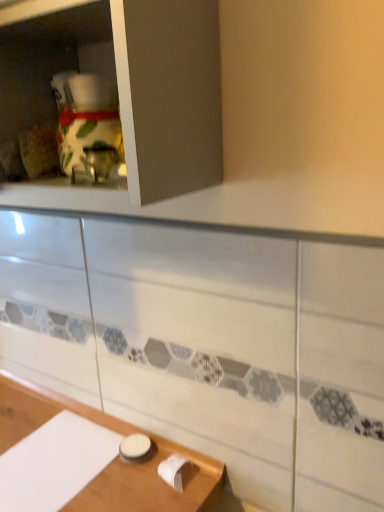
Question: From the image's perspective, does white glossy jar at lower center appear higher than white glossy cabinet at upper left?

Choices:
 (A) yes
 (B) no

Answer: (B)

Question: Does white glossy jar at lower center have a lesser width compared to white glossy cabinet at upper left?

Choices:
 (A) no
 (B) yes

Answer: (B)

Question: From a real-world perspective, is white glossy jar at lower center on top of white glossy cabinet at upper left?

Choices:
 (A) no
 (B) yes

Answer: (A)

Question: Is white glossy jar at lower center turned away from white glossy cabinet at upper left?

Choices:
 (A) yes
 (B) no

Answer: (B)

Question: Is white glossy jar at lower center further to camera compared to white glossy cabinet at upper left?

Choices:
 (A) yes
 (B) no

Answer: (A)

Question: Are white glossy jar at lower center and white glossy cabinet at upper left located far from each other?

Choices:
 (A) no
 (B) yes

Answer: (A)

Question: Is white glossy cabinet at upper left behind white glossy jar at lower center?

Choices:
 (A) yes
 (B) no

Answer: (B)

Question: Does white glossy cabinet at upper left appear on the left side of white glossy jar at lower center?

Choices:
 (A) yes
 (B) no

Answer: (A)

Question: From the image's perspective, does white glossy cabinet at upper left appear lower than white glossy jar at lower center?

Choices:
 (A) no
 (B) yes

Answer: (A)

Question: Can you confirm if white glossy cabinet at upper left is thinner than white glossy jar at lower center?

Choices:
 (A) yes
 (B) no

Answer: (B)

Question: Is white glossy cabinet at upper left positioned far away from white glossy jar at lower center?

Choices:
 (A) no
 (B) yes

Answer: (A)

Question: Is white glossy cabinet at upper left taller than white glossy jar at lower center?

Choices:
 (A) no
 (B) yes

Answer: (B)

Question: From a real-world perspective, is white glossy jar at lower center physically located above or below white glossy cabinet at upper left?

Choices:
 (A) below
 (B) above

Answer: (A)